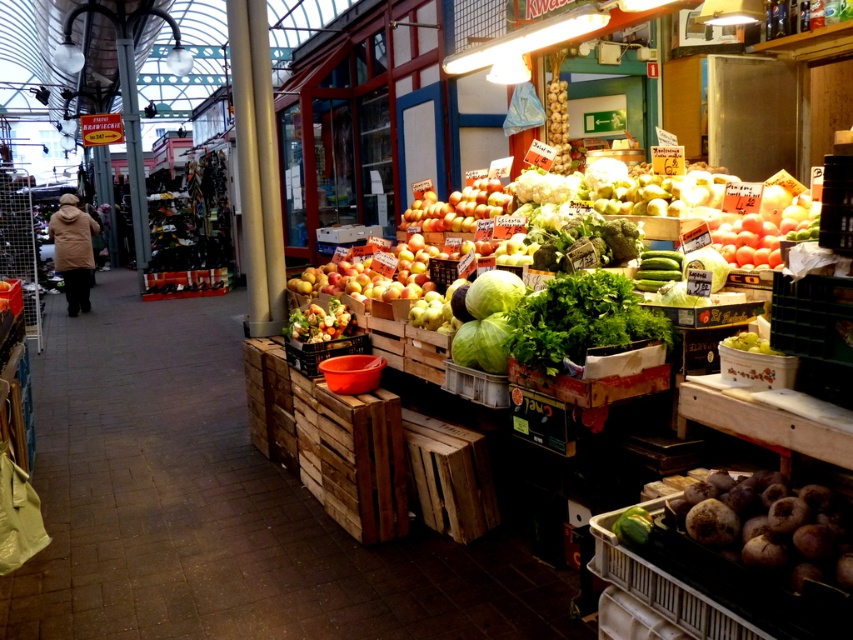
Which is above, dark purple root at lower right or green matte cabbage at center?

green matte cabbage at center is above.

Who is more distant from viewer, (830, 570) or (474, 336)?

Point (474, 336)

I want to click on dark purple root at lower right, so click(x=770, y=525).

From the picture: Who is higher up, dark brown coat at left or shiny green leafy vegetables at center?

Positioned higher is dark brown coat at left.

Does dark brown coat at left appear under shiny green leafy vegetables at center?

Incorrect, dark brown coat at left is not positioned below shiny green leafy vegetables at center.

Is point (73, 202) positioned after point (325, 317)?

That is True.

You are a GUI agent. You are given a task and a screenshot of the screen. Output one action in this format:
    pyautogui.click(x=<x>, y=<y>)
    Task: Click on the dark brown coat at left
    
    Given the screenshot: What is the action you would take?
    pyautogui.click(x=73, y=252)

Can you confirm if shiny golden apples at center is shorter than green matte cucumber at lower right?

Incorrect, shiny golden apples at center's height does not fall short of green matte cucumber at lower right's.

Consider the image. Does shiny golden apples at center appear under green matte cucumber at lower right?

Actually, shiny golden apples at center is above green matte cucumber at lower right.

This screenshot has width=853, height=640. Find the location of `shiny golden apples at center`. shiny golden apples at center is located at coordinates (699, 204).